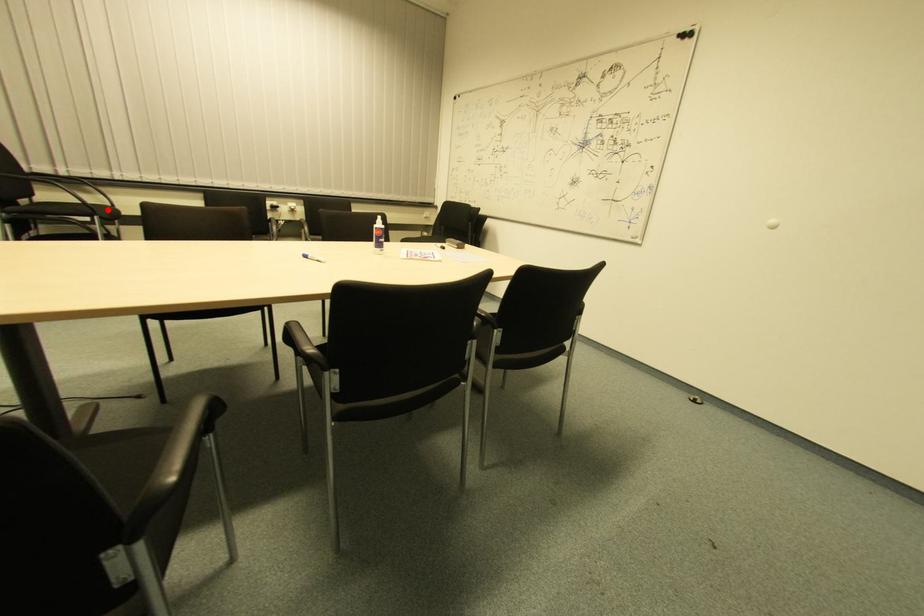
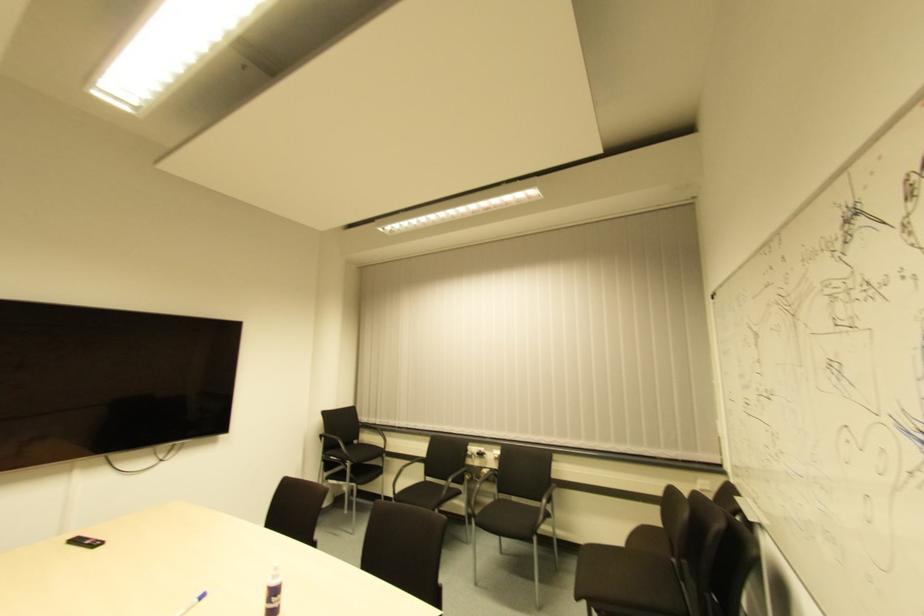
In the second image, find the point that corresponds to the highlighted location in the first image.

(381, 448)